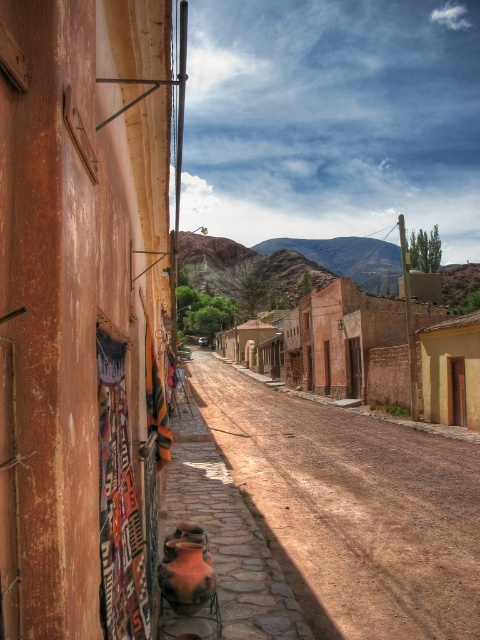
Question: Which of the following is the closest to the observer?

Choices:
 (A) (272, 525)
 (B) (418, 314)

Answer: (A)

Question: Is brown dirt track at center thinner than brown textured buildings at center?

Choices:
 (A) no
 (B) yes

Answer: (B)

Question: Can you confirm if brown dirt track at center is positioned above brown textured buildings at center?

Choices:
 (A) no
 (B) yes

Answer: (A)

Question: Can you confirm if brown dirt track at center is wider than brown textured buildings at center?

Choices:
 (A) yes
 (B) no

Answer: (B)

Question: Which point is farther to the camera?

Choices:
 (A) brown dirt track at center
 (B) brown textured buildings at center

Answer: (B)

Question: Which object appears farthest from the camera in this image?

Choices:
 (A) brown dirt track at center
 (B) brown textured buildings at center

Answer: (B)